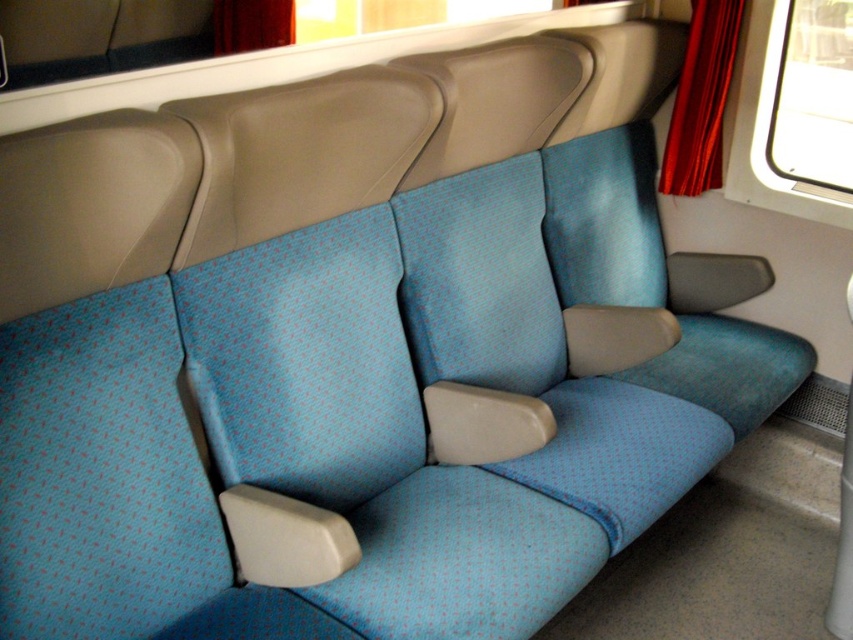
Question: Does velvet red curtain at upper right have a lesser width compared to red velvet curtain at upper center?

Choices:
 (A) no
 (B) yes

Answer: (B)

Question: Does transparent glass window at upper right appear on the right side of velvet red curtain at upper right?

Choices:
 (A) yes
 (B) no

Answer: (A)

Question: Can you confirm if transparent glass window at upper right is positioned to the right of velvet red curtain at upper right?

Choices:
 (A) yes
 (B) no

Answer: (A)

Question: Which object is farther from the camera taking this photo?

Choices:
 (A) red velvet curtain at upper center
 (B) velvet red curtain at upper right
 (C) transparent glass window at upper right

Answer: (A)

Question: Which point appears closest to the camera in this image?

Choices:
 (A) (663, 163)
 (B) (280, 19)

Answer: (A)

Question: Which of the following is the closest to the observer?

Choices:
 (A) (700, 100)
 (B) (230, 13)
 (C) (792, 172)

Answer: (A)